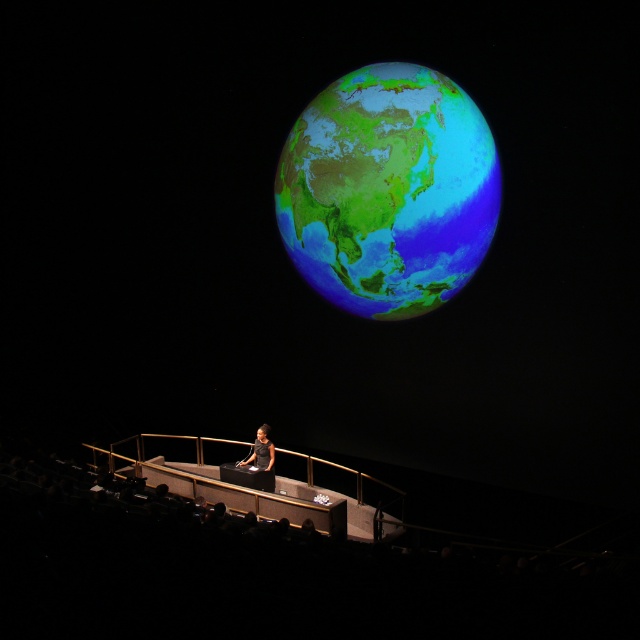
Which is behind, point (396, 266) or point (262, 438)?

Positioned behind is point (262, 438).

Is shiny metallic globe at upper center closer to the viewer compared to black matte dress at center?

Yes, shiny metallic globe at upper center is closer to the viewer.

Locate an element on the screen. The height and width of the screenshot is (640, 640). shiny metallic globe at upper center is located at coordinates (388, 189).